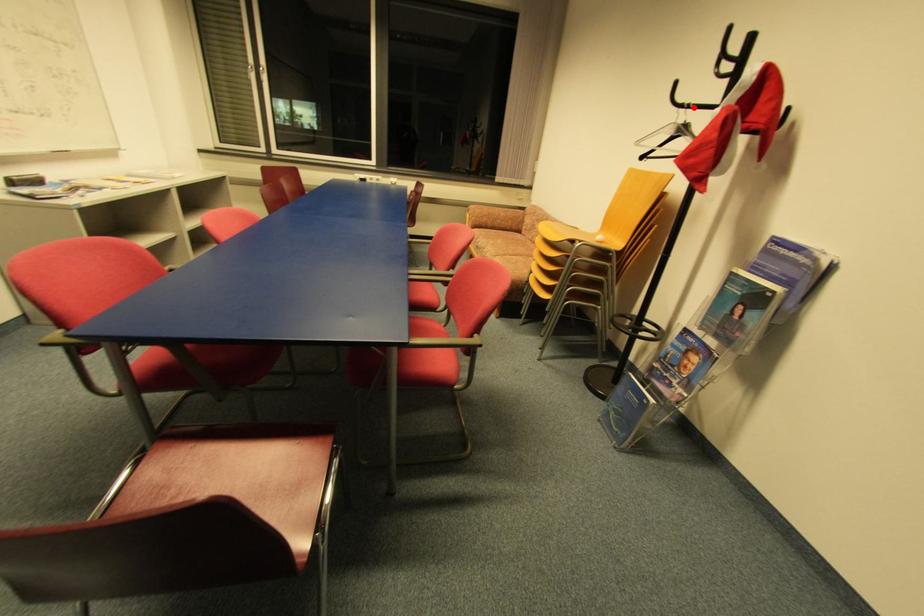
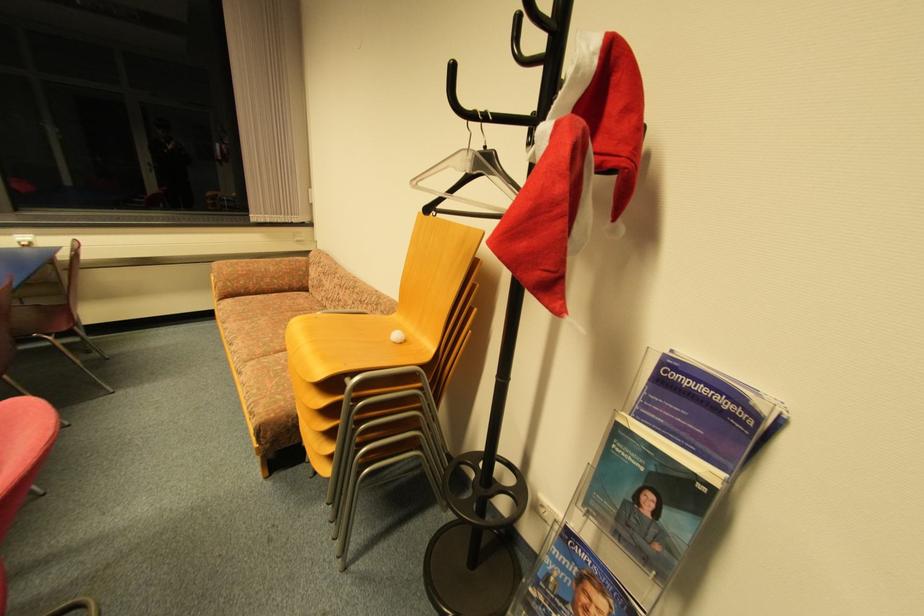
In the second image, find the point that corresponds to the highlighted location in the first image.

(489, 119)